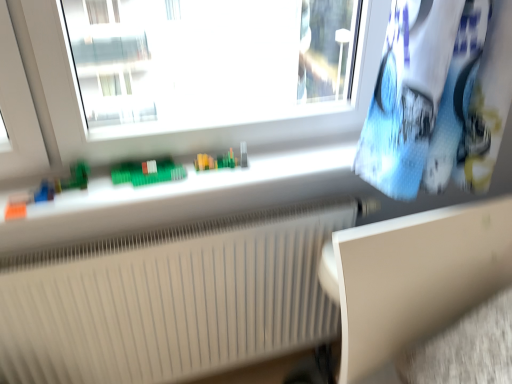
Image resolution: width=512 pixels, height=384 pixels. What do you see at coordinates (169, 300) in the screenshot?
I see `white ribbed radiator at lower center` at bounding box center [169, 300].

In order to click on white ribbed radiator at lower center in this screenshot , I will do `click(169, 300)`.

What do you see at coordinates (413, 277) in the screenshot? This screenshot has width=512, height=384. I see `white matte table at lower right` at bounding box center [413, 277].

Measure the distance between white matte table at lower right and camera.

38.73 inches.

This screenshot has width=512, height=384. In order to click on white matte table at lower right in this screenshot , I will do `click(413, 277)`.

I want to click on white ribbed radiator at lower center, so click(x=169, y=300).

Is white matte table at lower right to the left of white ribbed radiator at lower center from the viewer's perspective?

Incorrect, white matte table at lower right is not on the left side of white ribbed radiator at lower center.

Is white matte table at lower right in front of or behind white ribbed radiator at lower center in the image?

In the image, white matte table at lower right appears in front of white ribbed radiator at lower center.

Does point (409, 233) lie behind point (124, 322)?

No.

From the image's perspective, which one is positioned lower, white matte table at lower right or white ribbed radiator at lower center?

white ribbed radiator at lower center.

From a real-world perspective, is white matte table at lower right physically above white ribbed radiator at lower center?

Indeed, from a real-world perspective, white matte table at lower right stands above white ribbed radiator at lower center.

Considering the relative sizes of white matte table at lower right and white ribbed radiator at lower center in the image provided, is white matte table at lower right wider than white ribbed radiator at lower center?

Yes.

Between white matte table at lower right and white ribbed radiator at lower center, which one has less height?

white matte table at lower right is shorter.

Considering the sizes of objects white matte table at lower right and white ribbed radiator at lower center in the image provided, who is bigger, white matte table at lower right or white ribbed radiator at lower center?

With larger size is white ribbed radiator at lower center.

Does white matte table at lower right contain white ribbed radiator at lower center?

No.

Looking at this image, is there a large distance between white matte table at lower right and white ribbed radiator at lower center?

No, white matte table at lower right is not far away from white ribbed radiator at lower center.

Could you tell me if white matte table at lower right is turned towards white ribbed radiator at lower center?

No, white matte table at lower right is not aimed at white ribbed radiator at lower center.

Can you tell me how much white matte table at lower right and white ribbed radiator at lower center differ in facing direction?

white matte table at lower right and white ribbed radiator at lower center are facing 0.689 degrees away from each other.

Identify the location of table that appears in front of the white ribbed radiator at lower center. (413, 277).

Considering the relative positions of white ribbed radiator at lower center and white matte table at lower right in the image provided, is white ribbed radiator at lower center to the left or to the right of white matte table at lower right?

Clearly, white ribbed radiator at lower center is on the left of white matte table at lower right in the image.

Considering the relative positions of white ribbed radiator at lower center and white matte table at lower right in the image provided, is white ribbed radiator at lower center in front of white matte table at lower right?

No, the depth of white ribbed radiator at lower center is greater than that of white matte table at lower right.

Is point (216, 271) behind point (359, 296)?

That is True.

From the image's perspective, would you say white ribbed radiator at lower center is shown under white matte table at lower right?

Correct, white ribbed radiator at lower center appears lower than white matte table at lower right in the image.

From a real-world perspective, is white ribbed radiator at lower center physically above white matte table at lower right?

No, from a real-world perspective, white ribbed radiator at lower center is not above white matte table at lower right.

Between white ribbed radiator at lower center and white matte table at lower right, which one has smaller width?

white ribbed radiator at lower center.

Between white ribbed radiator at lower center and white matte table at lower right, which one has less height?

white matte table at lower right is shorter.

Considering the relative sizes of white ribbed radiator at lower center and white matte table at lower right in the image provided, is white ribbed radiator at lower center bigger than white matte table at lower right?

Correct, white ribbed radiator at lower center is larger in size than white matte table at lower right.

Is white ribbed radiator at lower center not within white matte table at lower right?

Absolutely, white ribbed radiator at lower center is external to white matte table at lower right.

Consider the image. Is the surface of white ribbed radiator at lower center in direct contact with white matte table at lower right?

There is a gap between white ribbed radiator at lower center and white matte table at lower right.

Could you tell me if white ribbed radiator at lower center is facing white matte table at lower right?

Yes, white ribbed radiator at lower center is facing white matte table at lower right.

How many degrees apart are the facing directions of white ribbed radiator at lower center and white matte table at lower right?

They differ by 0.689 degrees in their facing directions.

Measure the distance between white ribbed radiator at lower center and white matte table at lower right.

A distance of 18.44 inches exists between white ribbed radiator at lower center and white matte table at lower right.

Find the location of `table above the white ribbed radiator at lower center (from a real-world perspective)`. table above the white ribbed radiator at lower center (from a real-world perspective) is located at coordinates (413, 277).

The image size is (512, 384). What are the coordinates of `radiator beneath the white matte table at lower right (from a real-world perspective)` in the screenshot? It's located at (169, 300).

Identify the location of radiator that is below the white matte table at lower right (from the image's perspective). (169, 300).